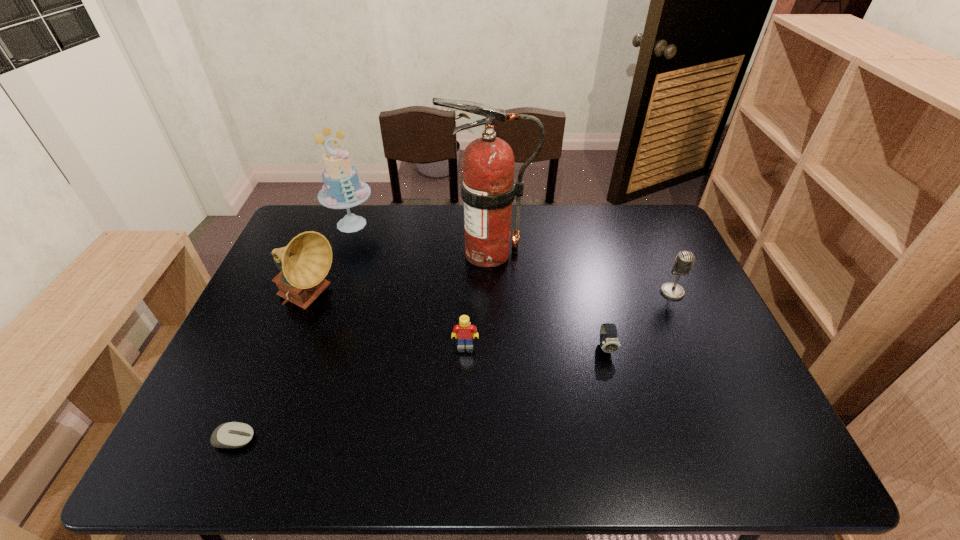
Where is `blank area located 0.190m at the nozzle of the tallest object`? The image size is (960, 540). blank area located 0.190m at the nozzle of the tallest object is located at coordinates (384, 253).

Find the location of a particular element. free spot located at the nozzle of the tallest object is located at coordinates (391, 253).

You are a GUI agent. You are given a task and a screenshot of the screen. Output one action in this format:
    pyautogui.click(x=<x>, y=<y>)
    Task: Click on the blank space located 0.330m at the nozzle of the tallest object
    
    Given the screenshot: What is the action you would take?
    pyautogui.click(x=341, y=253)

What are the coordinates of `vacant space situated with a ladder on the side of the cake` in the screenshot? It's located at (343, 248).

This screenshot has height=540, width=960. I want to click on vacant space positioned on the horn of the phonograph record, so click(451, 300).

The height and width of the screenshot is (540, 960). Identify the location of free spot located on the front of the rightmost object. (706, 367).

The height and width of the screenshot is (540, 960). In order to click on free space located 0.250m on the front-facing side of the fifth tallest object in this screenshot , I will do `click(463, 442)`.

You are a GUI agent. You are given a task and a screenshot of the screen. Output one action in this format:
    pyautogui.click(x=<x>, y=<y>)
    Task: Click on the vacant space located on the face of the sixth tallest object
    Image resolution: width=960 pixels, height=540 pixels.
    Given the screenshot: What is the action you would take?
    pyautogui.click(x=618, y=396)

Locate an element on the screen. free space located 0.090m on the wheel side of the shortest object is located at coordinates (296, 439).

The image size is (960, 540). I want to click on fire extinguisher located in the far edge section of the desktop, so click(488, 187).